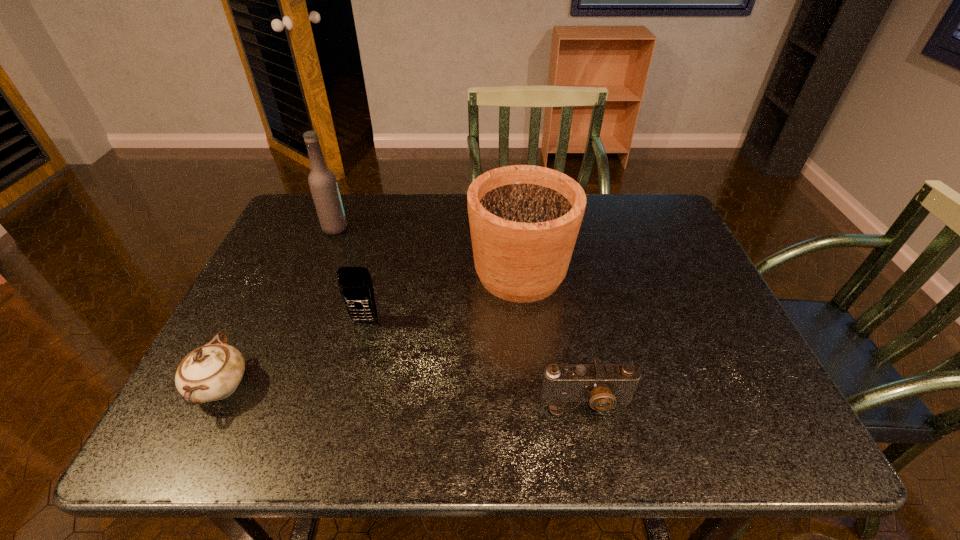
At what (x,y) coordinates should I click in order to perform the action: click on the second object from left to right. Please return your answer as a coordinate pair (x, y). Image resolution: width=960 pixels, height=540 pixels. Looking at the image, I should click on (322, 181).

The height and width of the screenshot is (540, 960). Identify the location of beer bottle. (322, 181).

Find the location of a particular element. the second farthest object is located at coordinates (524, 220).

The height and width of the screenshot is (540, 960). In order to click on flowerpot in this screenshot , I will do `click(524, 220)`.

Locate an element on the screen. the third shortest object is located at coordinates (355, 284).

The height and width of the screenshot is (540, 960). I want to click on cellular telephone, so click(355, 284).

Where is `the fourth tallest object`? Image resolution: width=960 pixels, height=540 pixels. the fourth tallest object is located at coordinates (212, 372).

You are a GUI agent. You are given a task and a screenshot of the screen. Output one action in this format:
    pyautogui.click(x=<x>, y=<y>)
    Task: Click on the leftmost object
    This screenshot has height=540, width=960.
    Given the screenshot: What is the action you would take?
    click(x=212, y=372)

The width and height of the screenshot is (960, 540). I want to click on the shortest object, so 602,385.

This screenshot has width=960, height=540. Find the location of `vacant space located 0.260m on the side of the fourth object from right to left with the label`. vacant space located 0.260m on the side of the fourth object from right to left with the label is located at coordinates (435, 228).